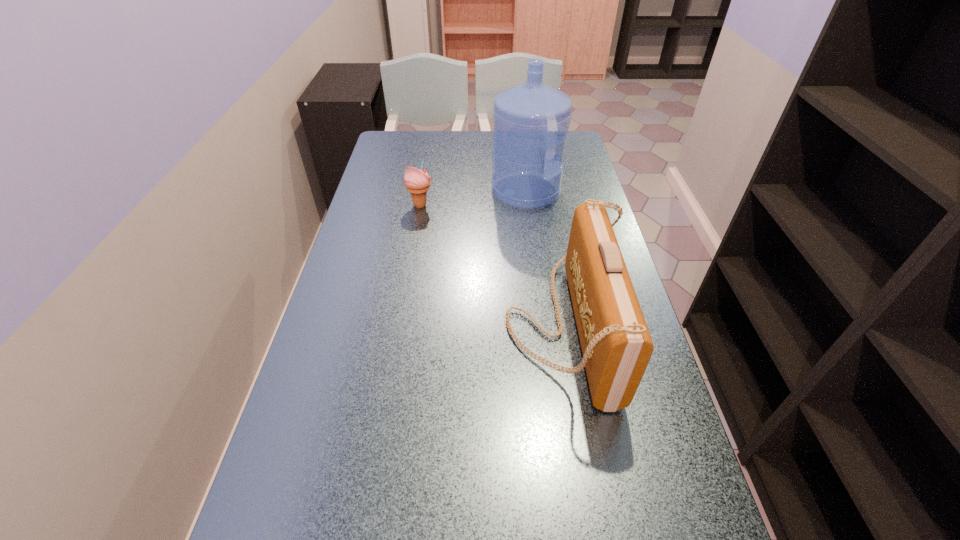
Select which object appears as the second closest to the shortest object. Please provide its 2D coordinates. Your answer should be formatted as a tuple, i.e. [(x, y)], where the tuple contains the x and y coordinates of a point satisfying the conditions above.

[(616, 345)]